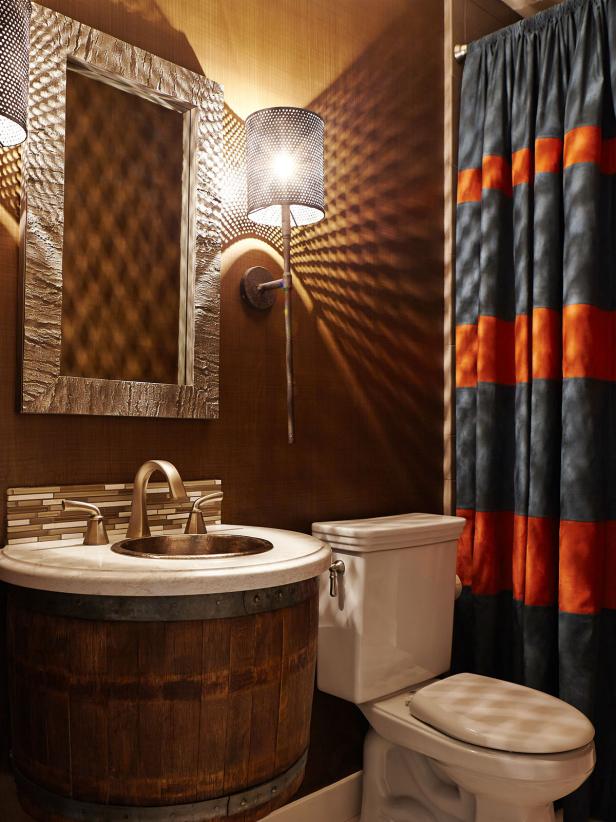
Locate an element on the screen. Image resolution: width=616 pixels, height=822 pixels. mirror is located at coordinates (123, 308).